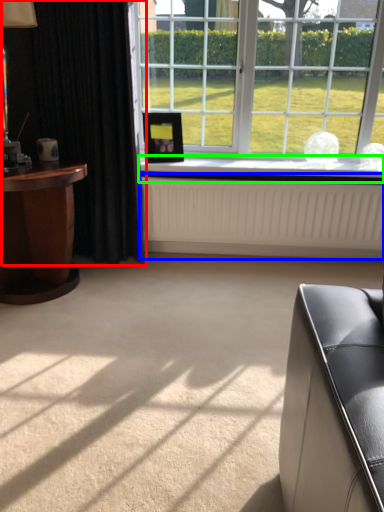
Question: Which is nearer to the curtain (highlighted by a red box)? radiator (highlighted by a blue box) or window sill (highlighted by a green box).

Choices:
 (A) radiator
 (B) window sill

Answer: (B)